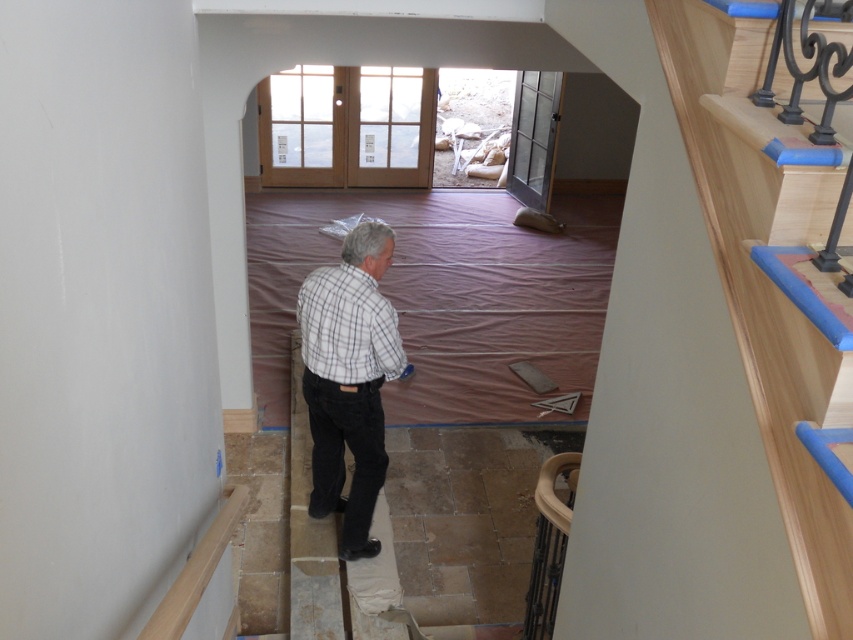
Question: Which point appears farthest from the camera in this image?

Choices:
 (A) (341, 358)
 (B) (302, 358)

Answer: (B)

Question: Which of the following is the farthest from the observer?

Choices:
 (A) plaid cotton shirt at center
 (B) white checkered shirt at center

Answer: (A)

Question: Which object appears closest to the camera in this image?

Choices:
 (A) white checkered shirt at center
 (B) plaid cotton shirt at center

Answer: (A)

Question: Is white checkered shirt at center to the right of plaid cotton shirt at center from the viewer's perspective?

Choices:
 (A) yes
 (B) no

Answer: (B)

Question: Does white checkered shirt at center come in front of plaid cotton shirt at center?

Choices:
 (A) no
 (B) yes

Answer: (B)

Question: Is white checkered shirt at center smaller than plaid cotton shirt at center?

Choices:
 (A) yes
 (B) no

Answer: (B)